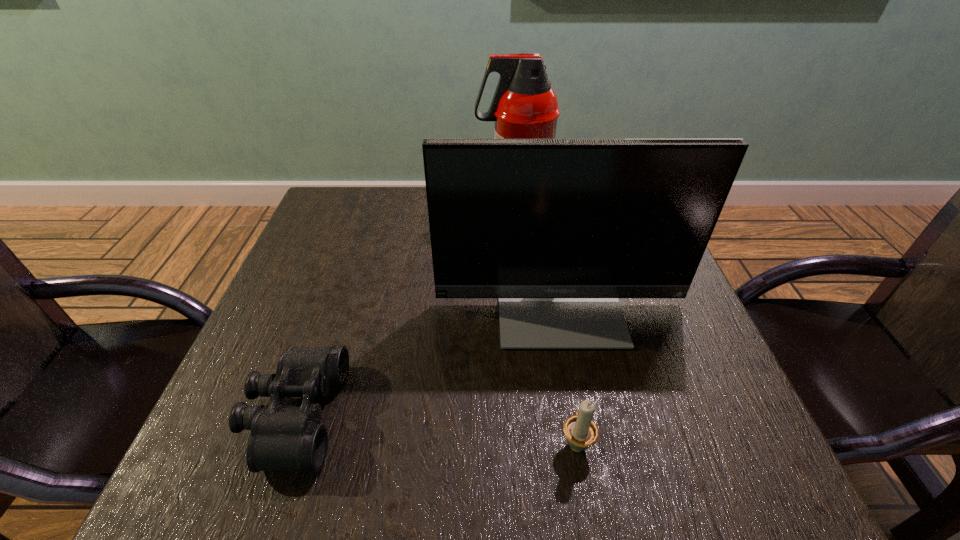
Image resolution: width=960 pixels, height=540 pixels. I want to click on the farthest object, so click(x=524, y=106).

At what (x,y) coordinates should I click in order to perform the action: click on the third nearest object. Please return your answer as a coordinate pair (x, y). This screenshot has height=540, width=960. Looking at the image, I should click on (558, 229).

You are a GUI agent. You are given a task and a screenshot of the screen. Output one action in this format:
    pyautogui.click(x=<x>, y=<y>)
    Task: Click on the second shortest object
    
    Given the screenshot: What is the action you would take?
    pyautogui.click(x=581, y=432)

In order to click on binoculars in this screenshot , I will do `click(283, 437)`.

Locate an element on the screen. the leftmost object is located at coordinates (283, 437).

Locate an element on the screen. vacant space located on the trigger side of the farthest object is located at coordinates (363, 209).

Where is `vacant space located on the trigger side of the farthest object`? vacant space located on the trigger side of the farthest object is located at coordinates click(367, 209).

The height and width of the screenshot is (540, 960). What are the coordinates of `vacant region located 0.060m on the trigger side of the farthest object` in the screenshot? It's located at tap(454, 209).

This screenshot has width=960, height=540. Find the location of `free space located 0.060m on the screen of the second farthest object`. free space located 0.060m on the screen of the second farthest object is located at coordinates (572, 375).

You are a GUI agent. You are given a task and a screenshot of the screen. Output one action in this format:
    pyautogui.click(x=<x>, y=<y>)
    Task: Click on the free space located 0.240m on the handle side of the second shortest object
    The height and width of the screenshot is (540, 960).
    Given the screenshot: What is the action you would take?
    pyautogui.click(x=555, y=318)